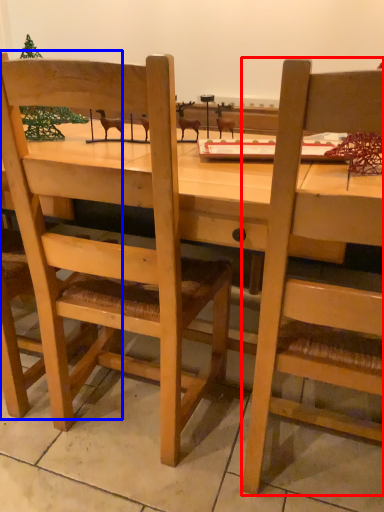
Question: Among these objects, which one is farthest to the camera, chair (highlighted by a red box) or chair (highlighted by a blue box)?

Choices:
 (A) chair
 (B) chair

Answer: (B)